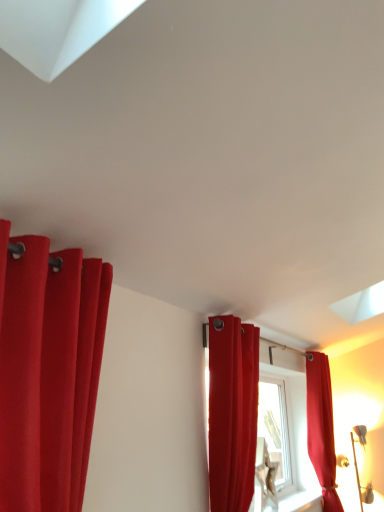
Question: Could you tell me if matte red curtain at center, which ranks as the second curtain in back-to-front order, is turned towards matte red curtain at left, arranged as the 3th curtain when viewed from the right?

Choices:
 (A) yes
 (B) no

Answer: (B)

Question: From the image's perspective, is matte red curtain at center, which ranks as the second curtain in back-to-front order, over matte red curtain at left, arranged as the 3th curtain when viewed from the right?

Choices:
 (A) yes
 (B) no

Answer: (B)

Question: Is matte red curtain at center, which ranks as the 2th curtain in front-to-back order, positioned behind matte red curtain at left, arranged as the 3th curtain when viewed from the right?

Choices:
 (A) yes
 (B) no

Answer: (A)

Question: Does matte red curtain at center, which ranks as the 2th curtain in front-to-back order, appear on the left side of matte red curtain at left, arranged as the 3th curtain when viewed from the right?

Choices:
 (A) yes
 (B) no

Answer: (B)

Question: Does matte red curtain at center, which is the second curtain in right-to-left order, have a smaller size compared to matte red curtain at left, which ranks as the third curtain in back-to-front order?

Choices:
 (A) no
 (B) yes

Answer: (A)

Question: Considering the relative positions of matte red curtain at center, which is the second curtain in right-to-left order, and matte red curtain at left, which is the 1th curtain in front-to-back order, in the image provided, is matte red curtain at center, which is the second curtain in right-to-left order, to the right of matte red curtain at left, which is the 1th curtain in front-to-back order, from the viewer's perspective?

Choices:
 (A) yes
 (B) no

Answer: (A)

Question: Is matte red curtain at center, which is the second curtain in right-to-left order, positioned far away from matte red curtain at right, the 3th curtain viewed from the left?

Choices:
 (A) no
 (B) yes

Answer: (B)

Question: Does matte red curtain at center, which ranks as the 2th curtain in front-to-back order, touch matte red curtain at right, the 1th curtain when ordered from back to front?

Choices:
 (A) yes
 (B) no

Answer: (B)

Question: Can you confirm if matte red curtain at center, which ranks as the 2th curtain in front-to-back order, is wider than matte red curtain at right, the 1th curtain when ordered from back to front?

Choices:
 (A) yes
 (B) no

Answer: (B)

Question: Can you confirm if matte red curtain at center, which ranks as the second curtain in back-to-front order, is shorter than matte red curtain at right, the 3th curtain viewed from the left?

Choices:
 (A) no
 (B) yes

Answer: (B)

Question: From the image's perspective, would you say matte red curtain at center, which ranks as the second curtain in back-to-front order, is positioned over matte red curtain at right, the 3th curtain viewed from the left?

Choices:
 (A) no
 (B) yes

Answer: (B)

Question: Does matte red curtain at center, which is counted as the 2th curtain, starting from the left, lie in front of matte red curtain at right, placed as the 3th curtain when sorted from front to back?

Choices:
 (A) no
 (B) yes

Answer: (B)

Question: Is matte red curtain at right, placed as the 3th curtain when sorted from front to back, shorter than matte red curtain at left, which ranks as the third curtain in back-to-front order?

Choices:
 (A) yes
 (B) no

Answer: (B)